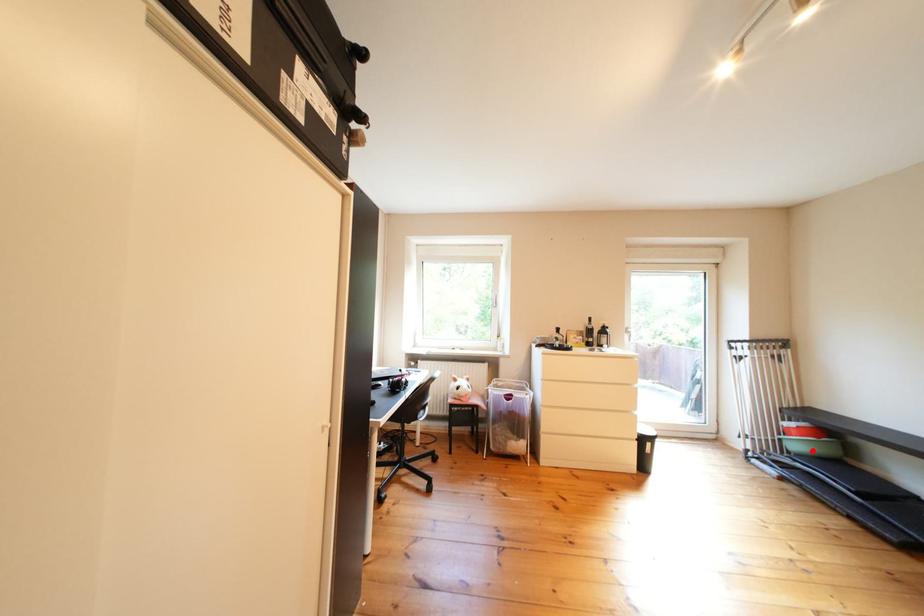
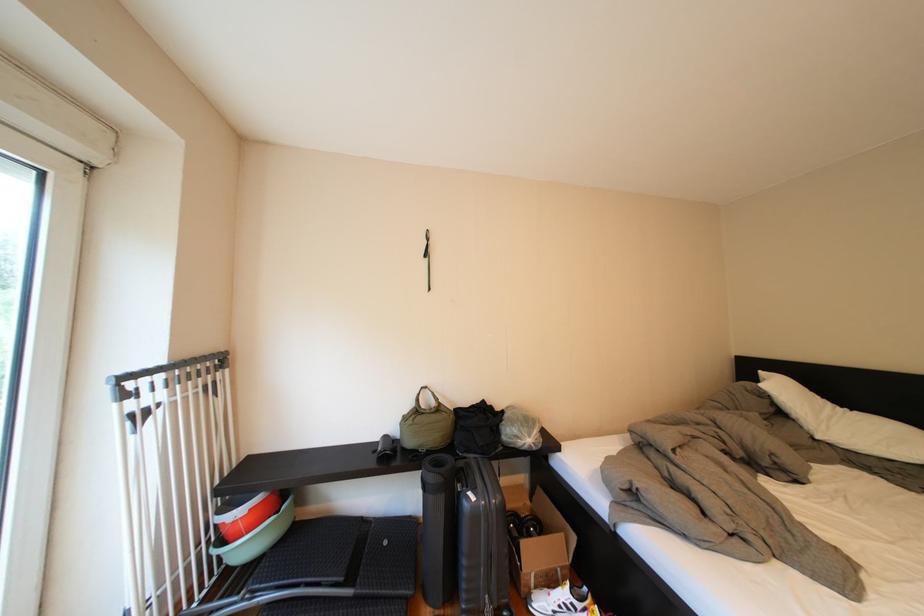
Question: I am providing you with two images of the same scene from different viewpoints. Given a red point in image1, look at the same physical point in image2. Is it:

Choices:
 (A) Closer to the viewpoint
 (B) Farther from the viewpoint

Answer: (B)